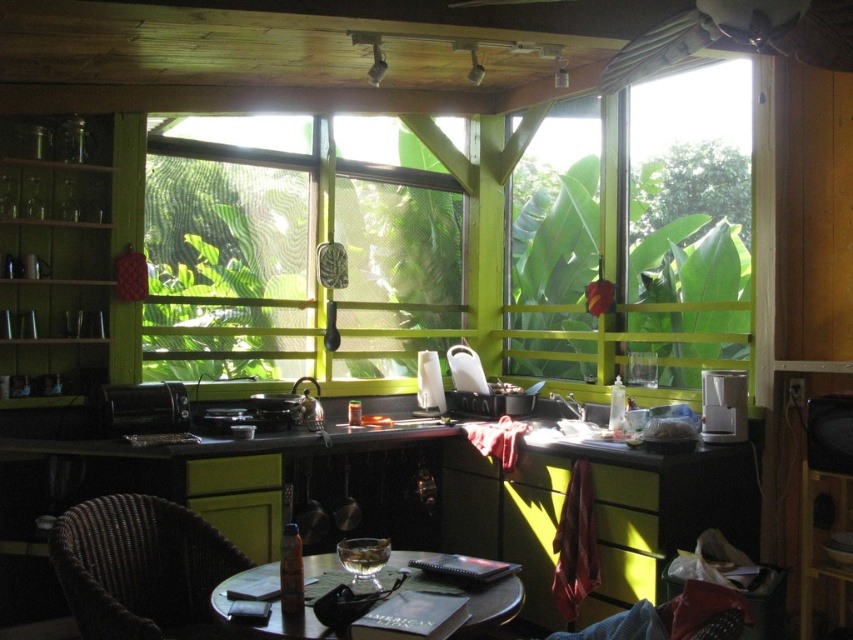
The height and width of the screenshot is (640, 853). Describe the element at coordinates (689, 186) in the screenshot. I see `transparent glass window at upper right` at that location.

In the scene shown: Can you confirm if transparent glass window at upper right is positioned to the left of wooden round table at center?

Incorrect, transparent glass window at upper right is not on the left side of wooden round table at center.

Between point (640, 230) and point (218, 593), which one is positioned behind?

The point (640, 230) is behind.

Identify the location of transparent glass window at upper right. (689, 186).

Does green wooden window at center appear over wooden round table at center?

Yes.

Does point (573, 112) come closer to viewer compared to point (496, 595)?

No, it is behind (496, 595).

Is point (575, 300) farther from camera compared to point (509, 609)?

Yes, it is behind point (509, 609).

Locate an element on the screen. green wooden window at center is located at coordinates (555, 209).

Is clear plastic window at center to the right of brown woven chair at lower left from the viewer's perspective?

Correct, you'll find clear plastic window at center to the right of brown woven chair at lower left.

Can you confirm if clear plastic window at center is positioned below brown woven chair at lower left?

No.

This screenshot has height=640, width=853. Find the location of `clear plastic window at center`. clear plastic window at center is located at coordinates (398, 262).